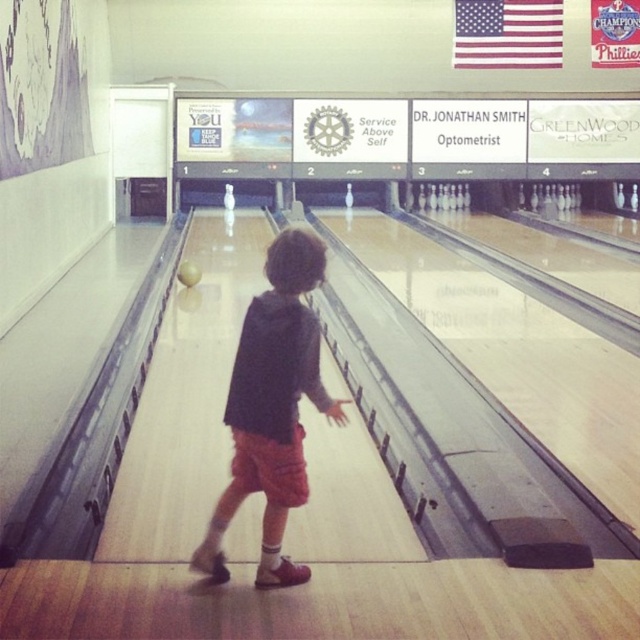
You are a customer at the bowling alley and want to find your dark gray hoodie at center. Where should you look relative to the bowling lanes?

The dark gray hoodie at center is located at point coordinates (273, 406) relative to the bowling lanes.

You are a parent trying to decide whether to let your child wear their dark gray hoodie at center while holding the yellow matte bowling ball at center during their bowling session. Considering the size of the hoodie and the ball, which item might be more challenging for the child to manage due to its size?

The dark gray hoodie at center is bigger than the yellow matte bowling ball at center, so the hoodie might be more challenging for the child to manage because of its larger size.

You are standing at the bowling alley and see two points marked on the lane. The first point is at position point (314, 260) and the second point is at point (189, 282). Which point is closer to you?

Point (314, 260) is closer to the viewer than point (189, 282).